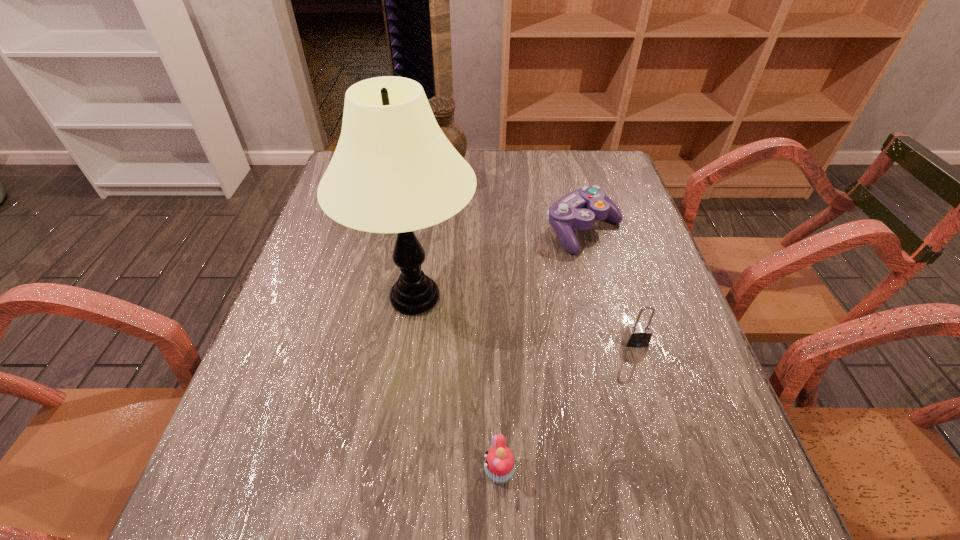
Identify the location of lamp. (393, 171).

Locate an element on the screen. The image size is (960, 540). the farthest object is located at coordinates (443, 107).

What are the coordinates of `the second tallest object` in the screenshot? It's located at (443, 107).

Where is `padlock`? The height and width of the screenshot is (540, 960). padlock is located at coordinates (636, 335).

Find the location of a particular element. The image size is (960, 540). control is located at coordinates (579, 209).

Image resolution: width=960 pixels, height=540 pixels. I want to click on the third object from left to right, so click(x=499, y=465).

This screenshot has height=540, width=960. Identify the location of the nearest object. (499, 465).

Locate an element on the screen. The image size is (960, 540). blank area located 0.090m on the left of the lamp is located at coordinates (313, 298).

I want to click on vacant area located 0.260m at the spout of the fourth shortest object, so click(x=552, y=176).

Locate an element on the screen. This screenshot has width=960, height=540. vacant space located 0.060m on the shackle of the padlock is located at coordinates (645, 373).